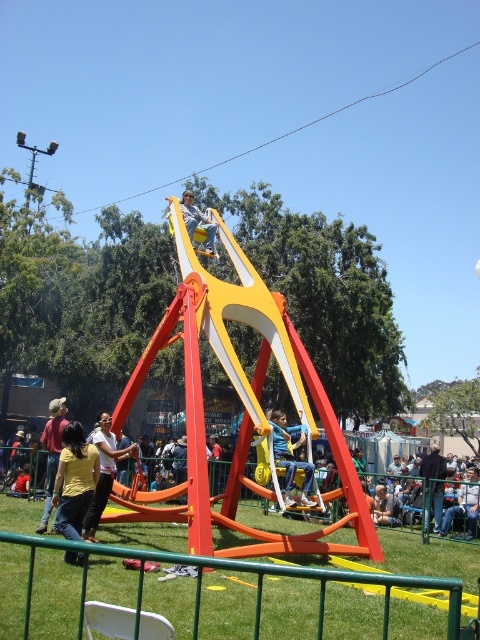
Is yellow matte swing at center further to camera compared to yellow shirt at lower left?

Yes, yellow matte swing at center is behind yellow shirt at lower left.

Does yellow matte swing at center appear on the left side of yellow shirt at lower left?

Incorrect, yellow matte swing at center is not on the left side of yellow shirt at lower left.

Who is more distant from viewer, (x=171, y=448) or (x=79, y=481)?

The point (x=171, y=448) is more distant.

Locate an element on the screen. This screenshot has height=640, width=480. yellow matte swing at center is located at coordinates (427, 504).

Is yellow shirt at lower left below yellow fabric shirt at center?

Indeed, yellow shirt at lower left is positioned under yellow fabric shirt at center.

Who is positioned more to the right, yellow shirt at lower left or yellow fabric shirt at center?

yellow fabric shirt at center

Locate an element on the screen. This screenshot has height=640, width=480. yellow shirt at lower left is located at coordinates (74, 481).

Identify the location of yellow shirt at lower left. (74, 481).

Based on the photo, does matte blue jeans at center have a lesser width compared to yellow fabric helmet at center?

In fact, matte blue jeans at center might be wider than yellow fabric helmet at center.

How much distance is there between matte blue jeans at center and yellow fabric helmet at center?

matte blue jeans at center and yellow fabric helmet at center are 34.43 feet apart.

What do you see at coordinates (290, 458) in the screenshot?
I see `matte blue jeans at center` at bounding box center [290, 458].

Locate an element on the screen. This screenshot has height=640, width=480. matte blue jeans at center is located at coordinates (290, 458).